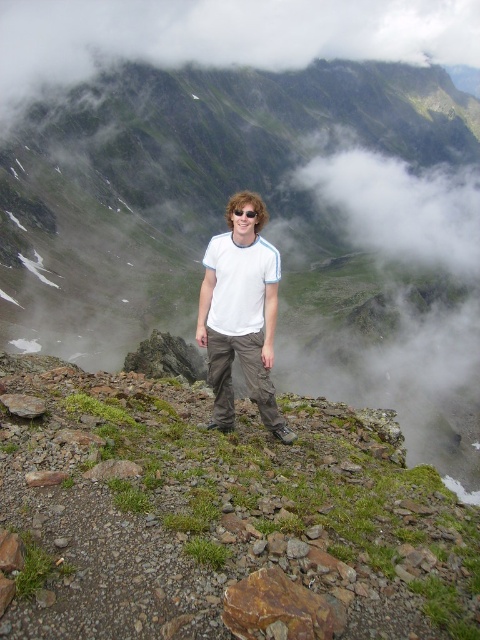
Question: Can you confirm if green mossy rock at center is positioned to the right of green mossy rocks at center?

Choices:
 (A) yes
 (B) no

Answer: (A)

Question: Which point is closer to the camera taking this photo?

Choices:
 (A) (0, 301)
 (B) (283, 516)
 (C) (262, 243)

Answer: (B)

Question: Can you confirm if green mossy rock at center is positioned above white cotton t-shirt at center?

Choices:
 (A) yes
 (B) no

Answer: (A)

Question: Is green mossy rock at center wider than white cotton t-shirt at center?

Choices:
 (A) no
 (B) yes

Answer: (B)

Question: Among these points, which one is farthest from the camera?

Choices:
 (A) (70, 337)
 (B) (240, 349)
 (C) (349, 476)

Answer: (A)

Question: Which point appears farthest from the camera in this image?

Choices:
 (A) (375, 506)
 (B) (61, 221)
 (C) (254, 218)

Answer: (B)